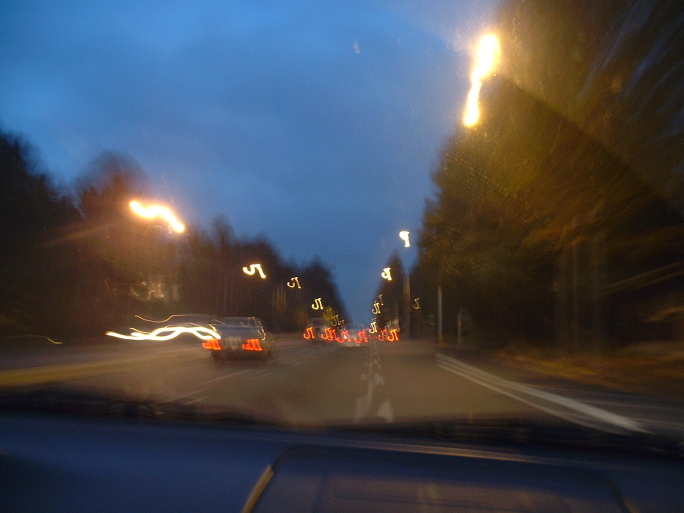
Find the location of a particular element. lights is located at coordinates (172, 223), (159, 211), (475, 88), (470, 106), (488, 40), (405, 238), (386, 272).